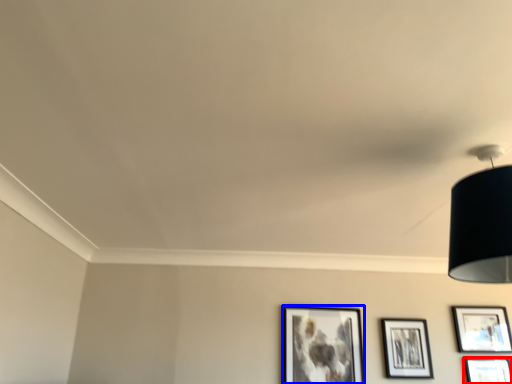
Question: Among these objects, which one is nearest to the camera, picture frame (highlighted by a red box) or picture frame (highlighted by a blue box)?

Choices:
 (A) picture frame
 (B) picture frame

Answer: (A)